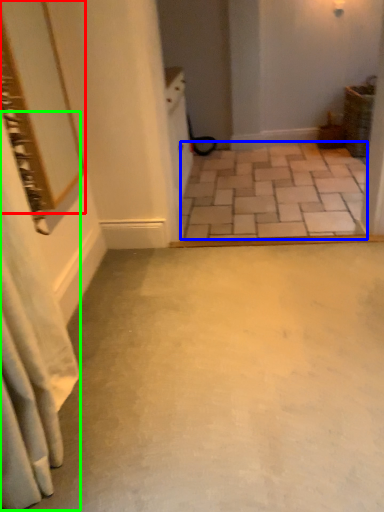
Question: Based on their relative distances, which object is farther from mirror (highlighted by a red box)? Choose from concrete (highlighted by a blue box) and shower curtain (highlighted by a green box).

Choices:
 (A) concrete
 (B) shower curtain

Answer: (A)